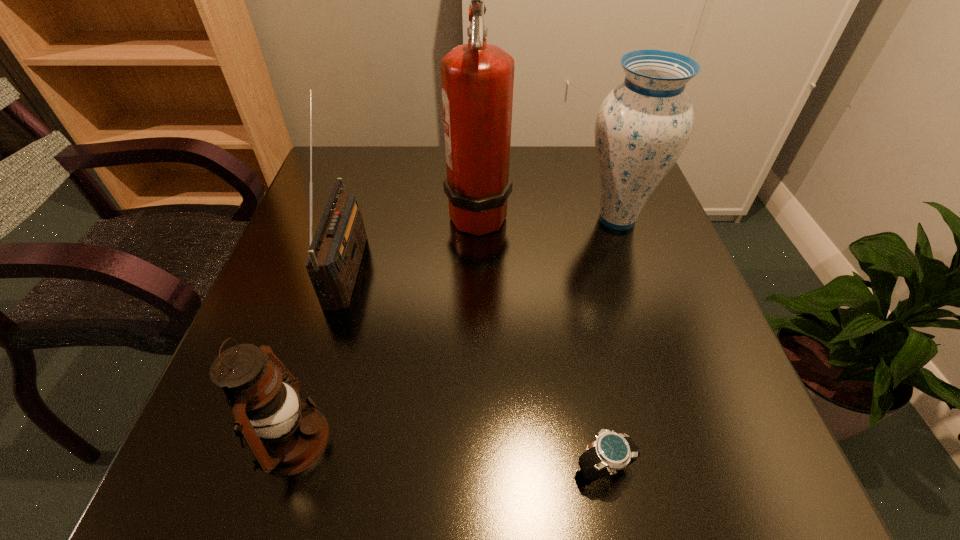
Find the location of `blank region between the third object from right to left and the radio receiver`. blank region between the third object from right to left and the radio receiver is located at coordinates click(413, 239).

What are the coordinates of `empty space between the radio receiver and the vase` in the screenshot? It's located at (482, 242).

At what (x,y) coordinates should I click in order to perform the action: click on free space between the tallest object and the radio receiver. Please return your answer as a coordinate pair (x, y). This screenshot has width=960, height=540. Looking at the image, I should click on (413, 239).

You are a GUI agent. You are given a task and a screenshot of the screen. Output one action in this format:
    pyautogui.click(x=<x>, y=<y>)
    Task: Click on the free spot between the vase and the third object from right to left
    The width and height of the screenshot is (960, 540).
    Given the screenshot: What is the action you would take?
    pyautogui.click(x=547, y=215)

This screenshot has height=540, width=960. I want to click on vacant region between the radio receiver and the vase, so click(482, 242).

Find the location of a particular element. vacant space that is in between the watch and the rightmost object is located at coordinates (611, 342).

The width and height of the screenshot is (960, 540). Identify the location of object that stands as the closest to the fourth object from left to right. (285, 435).

Image resolution: width=960 pixels, height=540 pixels. I want to click on object that stands as the second closest to the rightmost object, so click(x=610, y=452).

At what (x,y) coordinates should I click in order to perform the action: click on vacant space that satisfies the following two spatial constraints: 1. on the front-facing side of the radio receiver; 2. on the back side of the fourth object from left to right. Please return your answer as a coordinate pair (x, y). The height and width of the screenshot is (540, 960). Looking at the image, I should click on (288, 467).

Where is `vacant space that satisfies the following two spatial constraints: 1. on the front-facing side of the radio receiver; 2. on the right side of the fourth object from left to right`? vacant space that satisfies the following two spatial constraints: 1. on the front-facing side of the radio receiver; 2. on the right side of the fourth object from left to right is located at coordinates (288, 467).